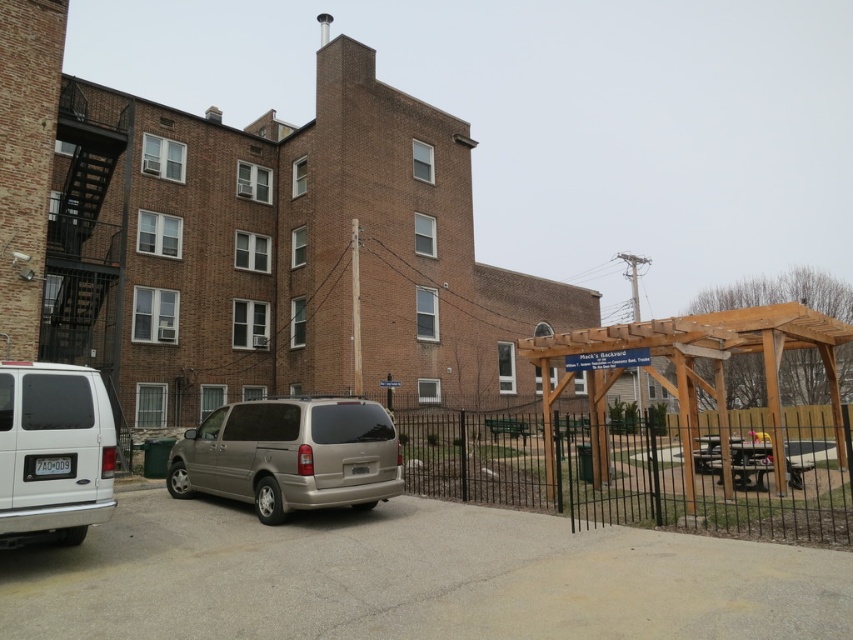
Does black metal fence at lower right have a lesser height compared to gold metallic minivan at center?

No, black metal fence at lower right is not shorter than gold metallic minivan at center.

Does black metal fence at lower right lie behind gold metallic minivan at center?

No, it is in front of gold metallic minivan at center.

This screenshot has height=640, width=853. What are the coordinates of `black metal fence at lower right` in the screenshot? It's located at (635, 472).

Is black metal fence at lower right bigger than white matte van at lower left?

Yes, black metal fence at lower right is bigger than white matte van at lower left.

Can you confirm if black metal fence at lower right is positioned below white matte van at lower left?

Yes.

Between point (498, 502) and point (33, 449), which one is positioned behind?

The point (498, 502) is behind.

Locate an element on the screen. This screenshot has width=853, height=640. black metal fence at lower right is located at coordinates (635, 472).

Does gold metallic minivan at center appear on the left side of white matte van at lower left?

In fact, gold metallic minivan at center is to the right of white matte van at lower left.

Can you confirm if gold metallic minivan at center is bigger than white matte van at lower left?

Indeed, gold metallic minivan at center has a larger size compared to white matte van at lower left.

Between point (207, 440) and point (44, 470), which one is positioned behind?

Point (207, 440)

At what (x,y) coordinates should I click in order to perform the action: click on gold metallic minivan at center. Please return your answer as a coordinate pair (x, y). The image size is (853, 640). Looking at the image, I should click on (289, 456).